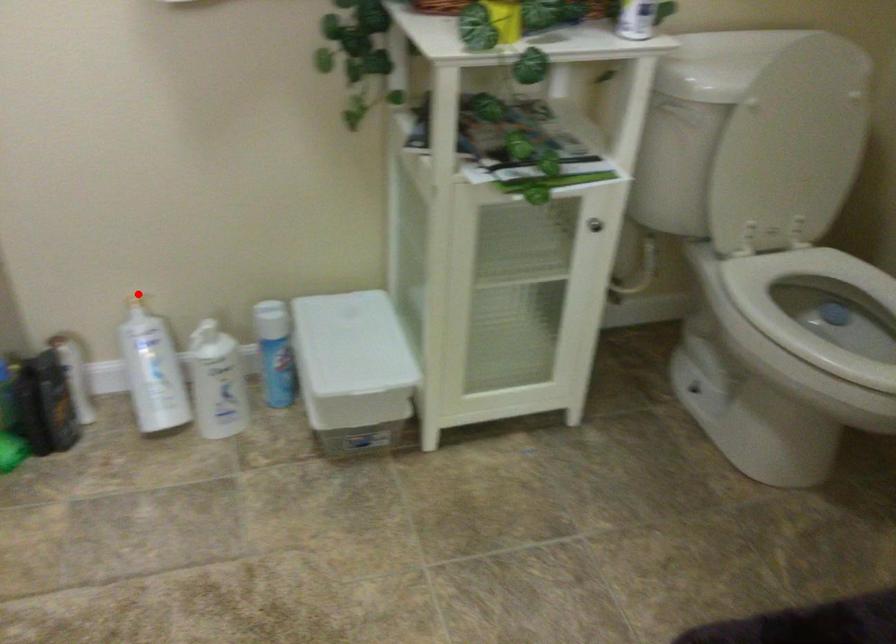
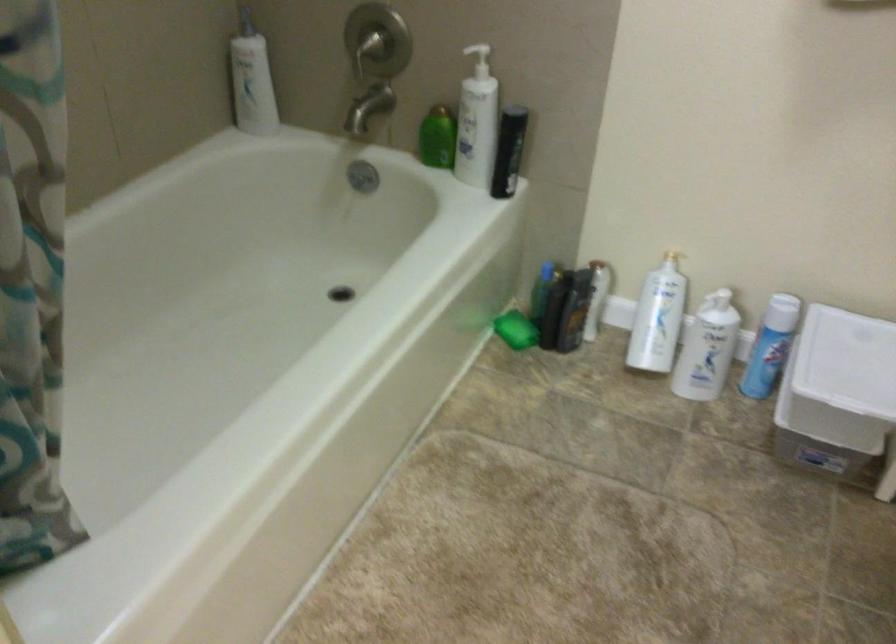
Where in the second image is the point corresponding to the highlighted location from the first image?

(672, 249)